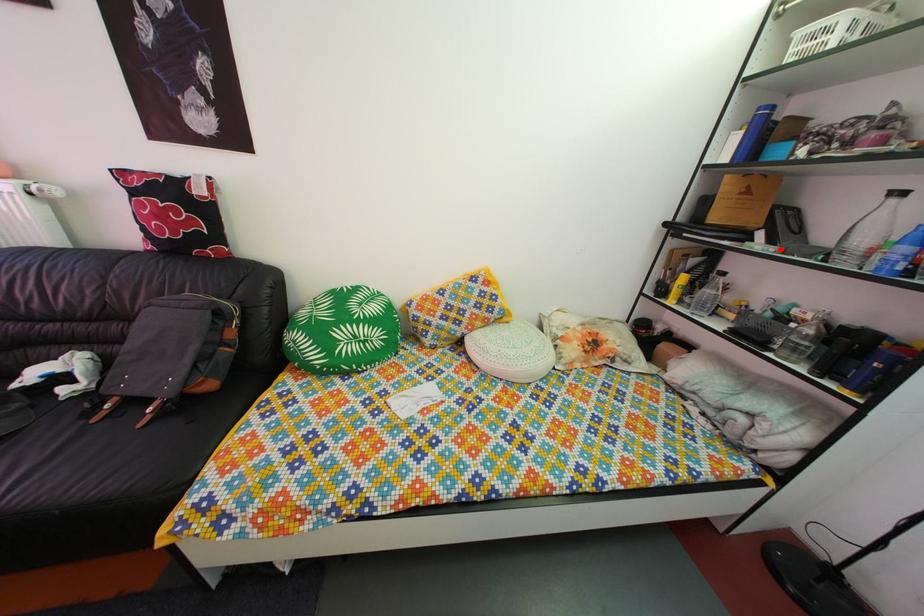
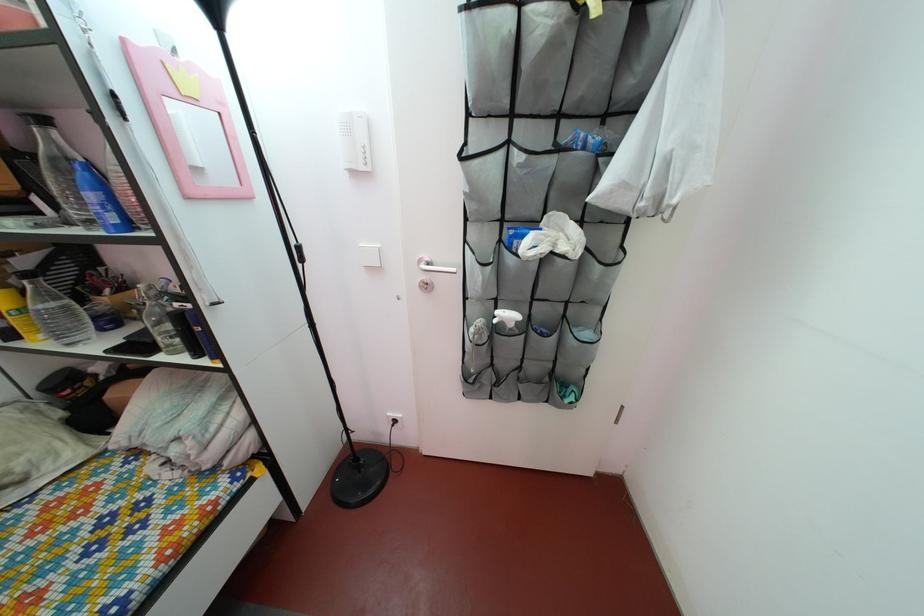
The point at the highlighted location is marked in the first image. Where is the corresponding point in the second image?

(68, 217)